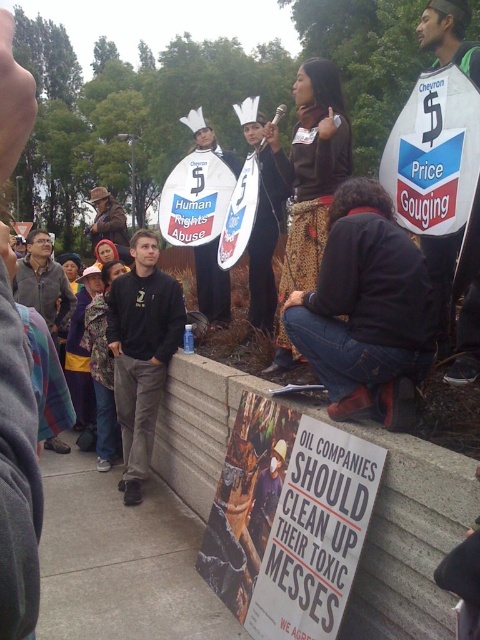
You are a photographer at the protest scene. You want to take a photo that includes both the matte paper poster at center and the dark gray jacket at center. Based on their arrangement, which object should appear to the left in the photo?

The dark gray jacket at center should appear to the left of the matte paper poster at center in the photo because the matte paper poster at center is positioned on the right side of the dark gray jacket at center.

Based on the scene described, which object is wider when comparing the leopard print jacket at lower center and the white plastic sign at upper right?

The leopard print jacket at lower center is wider than the white plastic sign at upper right according to the description.